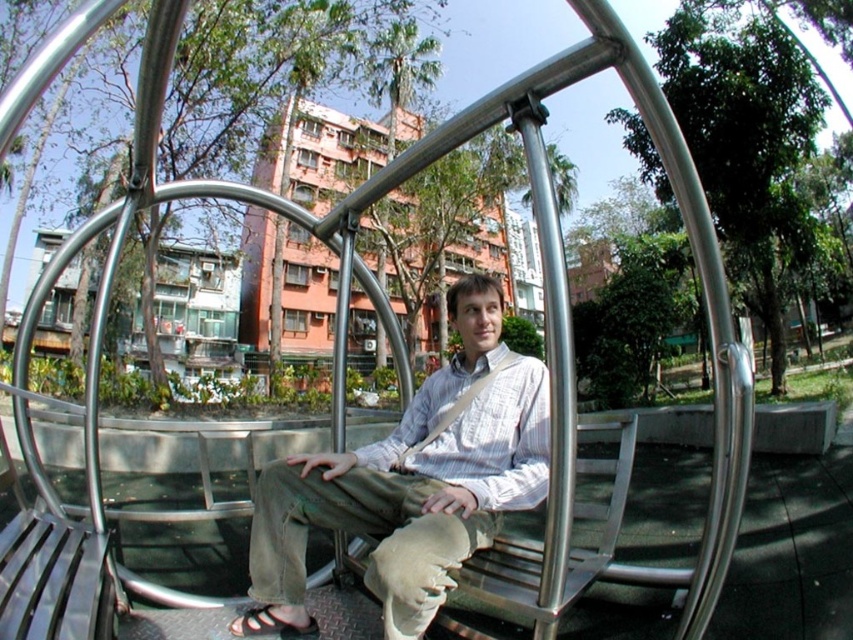
Question: In this image, where is light brown cotton pants at center located relative to black leather sandal at lower center?

Choices:
 (A) left
 (B) right

Answer: (B)

Question: Which of the following is the farthest from the observer?

Choices:
 (A) (254, 632)
 (B) (502, 419)

Answer: (A)

Question: Can you confirm if light brown cotton pants at center is positioned to the left of white fabric strap at center?

Choices:
 (A) yes
 (B) no

Answer: (A)

Question: Where is black leather sandal at lower center located in relation to white fabric strap at center in the image?

Choices:
 (A) above
 (B) below

Answer: (B)

Question: Among these objects, which one is nearest to the camera?

Choices:
 (A) black leather sandal at lower center
 (B) light brown cotton pants at center

Answer: (B)

Question: Estimate the real-world distances between objects in this image. Which object is farther from the black leather sandal at lower center?

Choices:
 (A) white fabric strap at center
 (B) light brown cotton pants at center

Answer: (A)